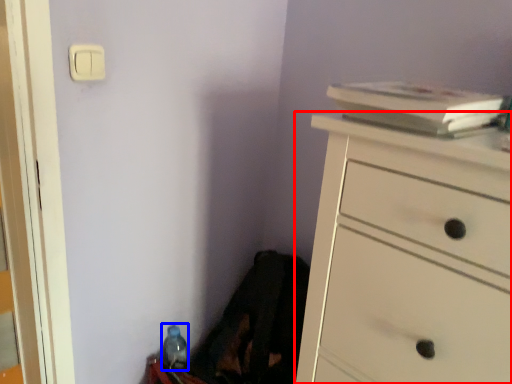
Question: Which object is closer to the camera taking this photo, chest of drawers (highlighted by a red box) or bottle (highlighted by a blue box)?

Choices:
 (A) chest of drawers
 (B) bottle

Answer: (A)